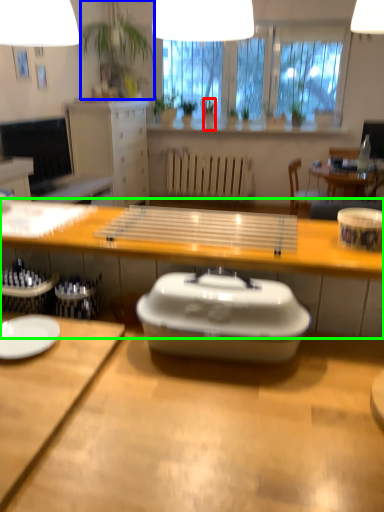
Question: Which object is positioned farthest from houseplant (highlighted by a red box)? Select from houseplant (highlighted by a blue box) and desk (highlighted by a green box).

Choices:
 (A) houseplant
 (B) desk

Answer: (B)